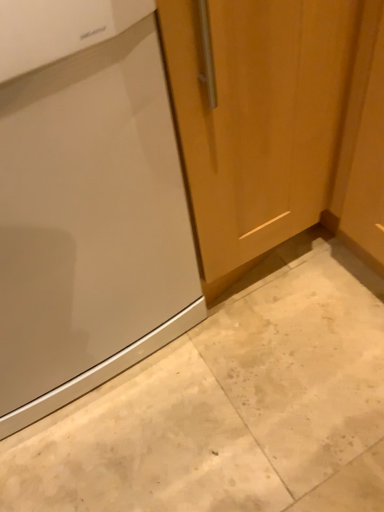
Question: Should I look upward or downward to see matte wood door at center?

Choices:
 (A) down
 (B) up

Answer: (B)

Question: Does satin finish refrigerator at left have a larger size compared to beige marble floor at lower left?

Choices:
 (A) no
 (B) yes

Answer: (B)

Question: Is there a large distance between satin finish refrigerator at left and beige marble floor at lower left?

Choices:
 (A) no
 (B) yes

Answer: (A)

Question: Does satin finish refrigerator at left have a lesser height compared to beige marble floor at lower left?

Choices:
 (A) no
 (B) yes

Answer: (A)

Question: Is satin finish refrigerator at left taller than beige marble floor at lower left?

Choices:
 (A) no
 (B) yes

Answer: (B)

Question: Is satin finish refrigerator at left further to camera compared to beige marble floor at lower left?

Choices:
 (A) yes
 (B) no

Answer: (A)

Question: Does satin finish refrigerator at left have a lesser width compared to beige marble floor at lower left?

Choices:
 (A) yes
 (B) no

Answer: (B)

Question: Does matte wood door at center contain beige marble floor at lower left?

Choices:
 (A) yes
 (B) no

Answer: (A)

Question: Can you confirm if matte wood door at center is bigger than beige marble floor at lower left?

Choices:
 (A) yes
 (B) no

Answer: (B)

Question: Is matte wood door at center closer to camera compared to beige marble floor at lower left?

Choices:
 (A) yes
 (B) no

Answer: (B)

Question: Is matte wood door at center further to the viewer compared to beige marble floor at lower left?

Choices:
 (A) yes
 (B) no

Answer: (A)

Question: Is matte wood door at center to the left of beige marble floor at lower left from the viewer's perspective?

Choices:
 (A) no
 (B) yes

Answer: (B)

Question: From a real-world perspective, is matte wood door at center positioned under beige marble floor at lower left based on gravity?

Choices:
 (A) no
 (B) yes

Answer: (A)

Question: Does matte wood door at center come in front of satin finish refrigerator at left?

Choices:
 (A) no
 (B) yes

Answer: (A)